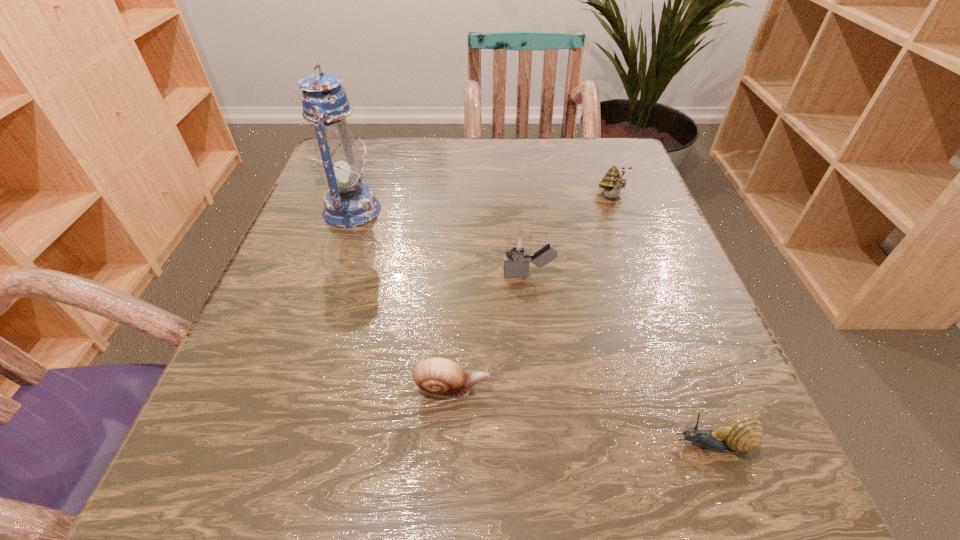
The height and width of the screenshot is (540, 960). Identify the location of free space between the farthest escargot and the leftmost escargot. (532, 293).

The image size is (960, 540). I want to click on free space between the nearest object and the third object from left to right, so click(621, 360).

Find the location of a particular element. This screenshot has width=960, height=540. empty space between the third object from left to right and the tallest escargot is located at coordinates (570, 236).

Locate an element on the screen. vacant point located between the tallest object and the igniter is located at coordinates (441, 242).

This screenshot has height=540, width=960. I want to click on vacant area that lies between the nearest object and the igniter, so (621, 360).

You are a GUI agent. You are given a task and a screenshot of the screen. Output one action in this format:
    pyautogui.click(x=<x>, y=<y>)
    Task: Click on the vacant point located between the leftmost object and the second nearest object
    This screenshot has width=960, height=540.
    Given the screenshot: What is the action you would take?
    pyautogui.click(x=401, y=300)

The width and height of the screenshot is (960, 540). In order to click on free spot between the third farthest object and the tallest escargot in this screenshot , I will do `click(570, 236)`.

The width and height of the screenshot is (960, 540). I want to click on free space between the second farthest escargot and the lantern, so click(x=401, y=300).

Locate an element on the screen. This screenshot has width=960, height=540. the third closest object relative to the third nearest object is located at coordinates click(x=349, y=203).

Where is `the closest object to the nearest object`? Image resolution: width=960 pixels, height=540 pixels. the closest object to the nearest object is located at coordinates (440, 377).